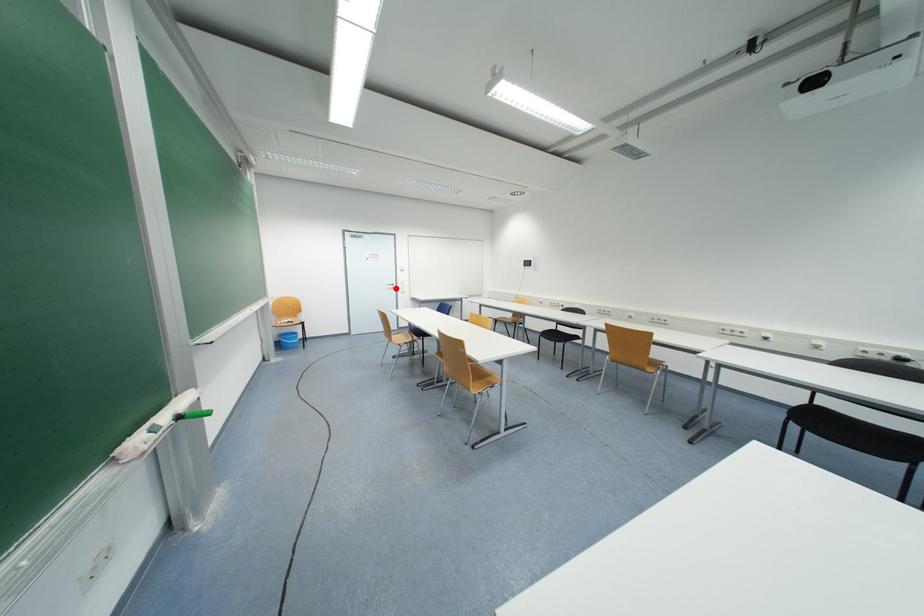
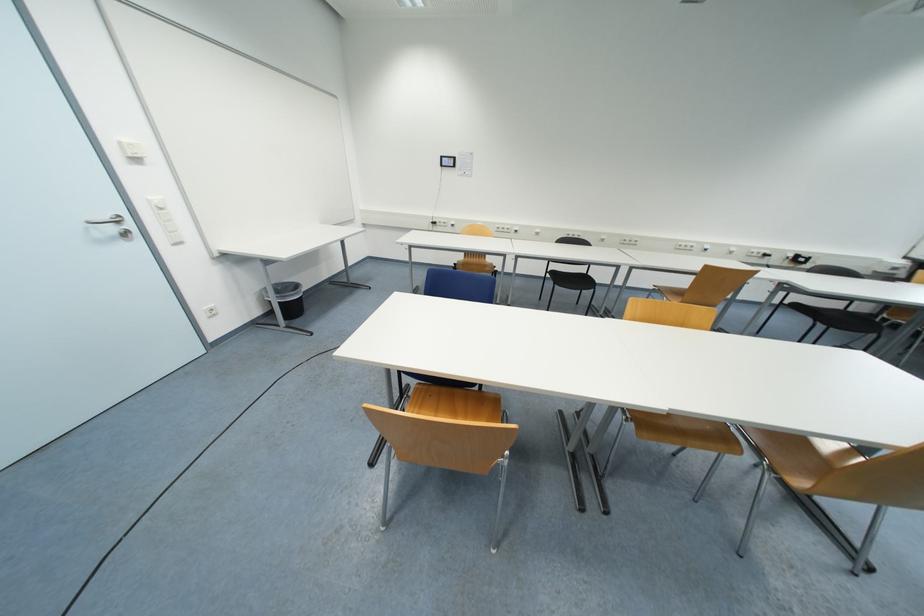
Question: I am providing you with two images of the same scene from different viewpoints. Image1 has a red point marked. In image2, the corresponding 3D location appears at what relative position? Reply with the corresponding letter.

Choices:
 (A) Closer
 (B) Farther

Answer: (B)